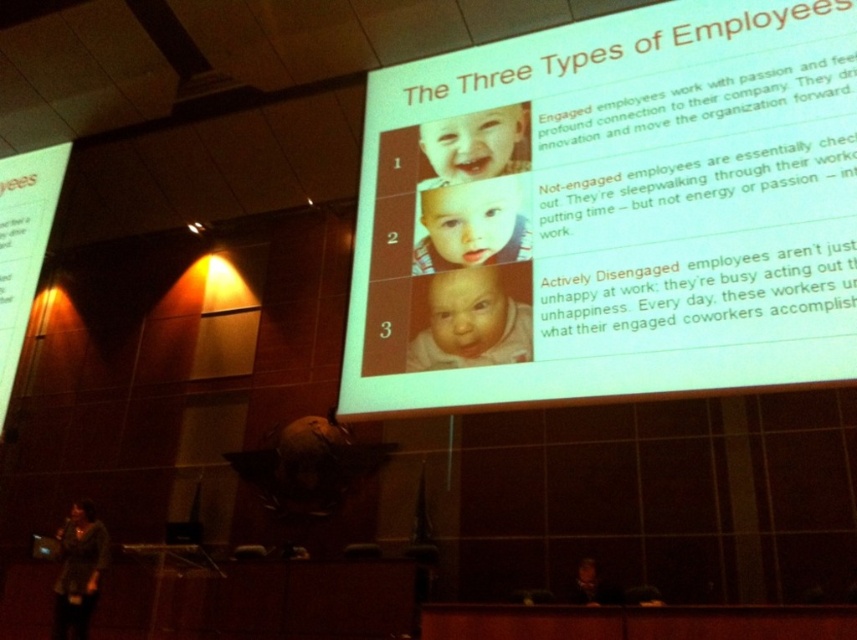
Is smooth white baby at center to the left of smooth plastic baby at center from the viewer's perspective?

No, smooth white baby at center is not to the left of smooth plastic baby at center.

Is smooth white baby at center above smooth plastic baby at center?

No, smooth white baby at center is not above smooth plastic baby at center.

Between point (448, 356) and point (489, 230), which one is positioned in front?

Point (448, 356) is more forward.

You are a GUI agent. You are given a task and a screenshot of the screen. Output one action in this format:
    pyautogui.click(x=<x>, y=<y>)
    Task: Click on the smooth white baby at center
    The height and width of the screenshot is (640, 857).
    Given the screenshot: What is the action you would take?
    pyautogui.click(x=470, y=323)

Who is higher up, white paper at upper center or smooth white baby at center?

white paper at upper center

Between point (656, 144) and point (526, 358), which one is positioned behind?

Positioned behind is point (656, 144).

Is point (800, 240) more distant than point (464, 333)?

No.

Where is `white paper at upper center`? The height and width of the screenshot is (640, 857). white paper at upper center is located at coordinates pos(609,212).

Can you confirm if white paper at upper center is wider than smooth plastic baby at center?

Yes, white paper at upper center is wider than smooth plastic baby at center.

What are the coordinates of `white paper at upper center` in the screenshot? It's located at (609, 212).

Describe the element at coordinates (609, 212) in the screenshot. This screenshot has width=857, height=640. I see `white paper at upper center` at that location.

At what (x,y) coordinates should I click in order to perform the action: click on white paper at upper center. Please return your answer as a coordinate pair (x, y). Looking at the image, I should click on (609, 212).